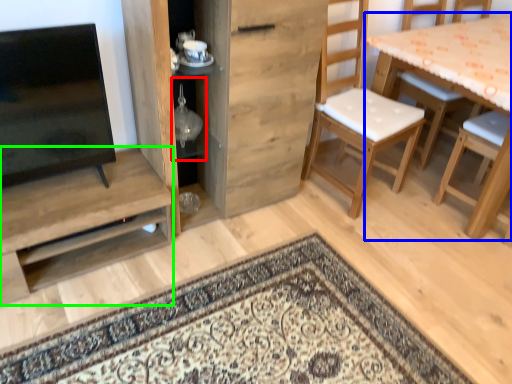
Question: Based on their relative distances, which object is nearer to shelf (highlighted by a red box)? Choose from table (highlighted by a blue box) and shelf (highlighted by a green box).

Choices:
 (A) table
 (B) shelf

Answer: (B)